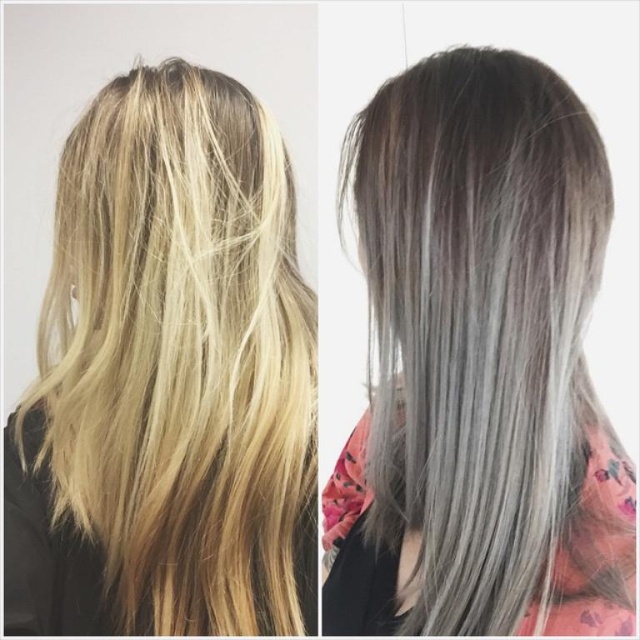
Question: Where is blonde silky hair at center located in relation to gray smooth hair at center in the image?

Choices:
 (A) below
 (B) above

Answer: (B)

Question: Is blonde silky hair at center positioned behind gray smooth hair at center?

Choices:
 (A) no
 (B) yes

Answer: (B)

Question: Does blonde silky hair at center have a larger size compared to gray smooth hair at center?

Choices:
 (A) yes
 (B) no

Answer: (A)